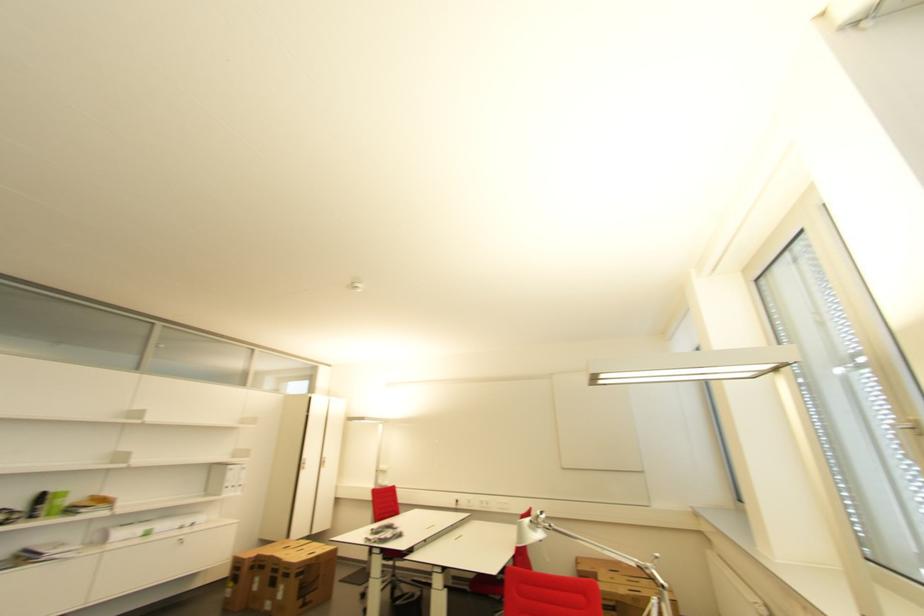
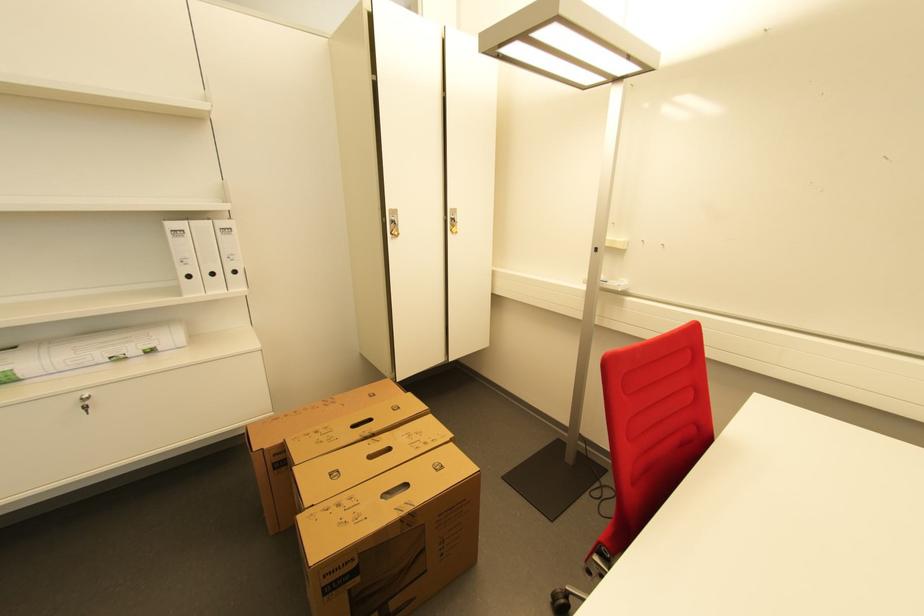
Locate, in the second image, the point that corresponds to (237,468) in the first image.

(176, 225)